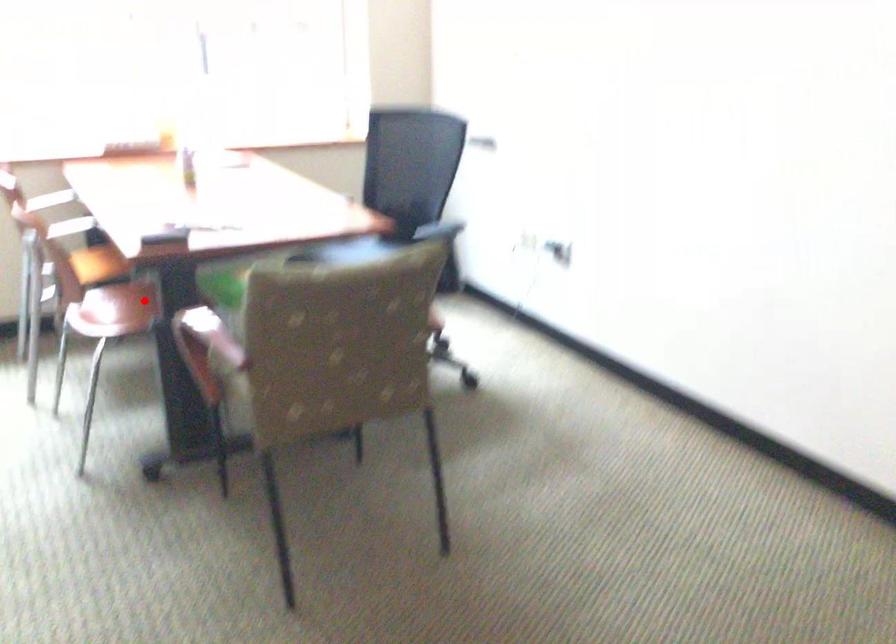
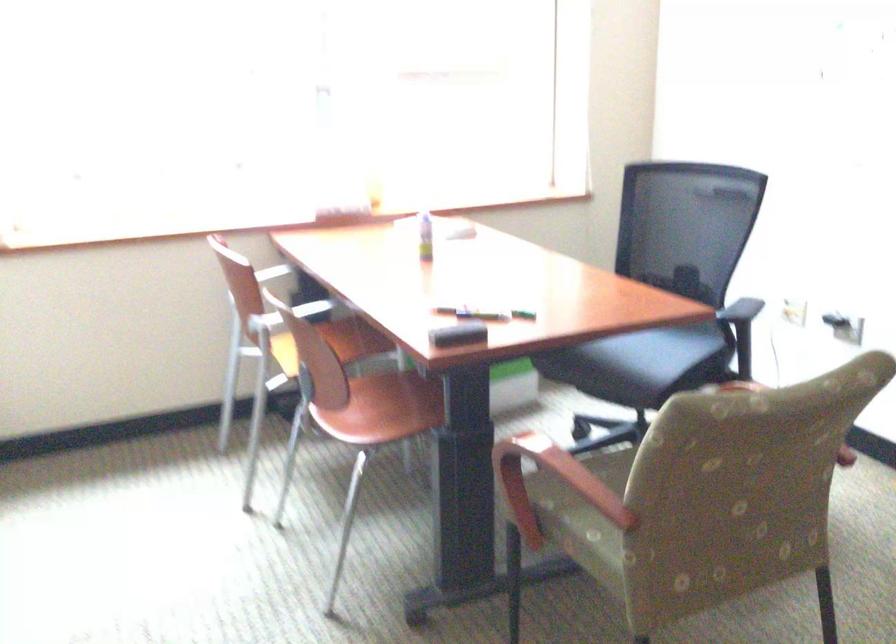
Question: I am providing you with two images of the same scene from different viewpoints. In image1, a red point is highlighted. Considering the same 3D point in image2, which of the following is correct?

Choices:
 (A) It is closer
 (B) It is farther

Answer: (A)